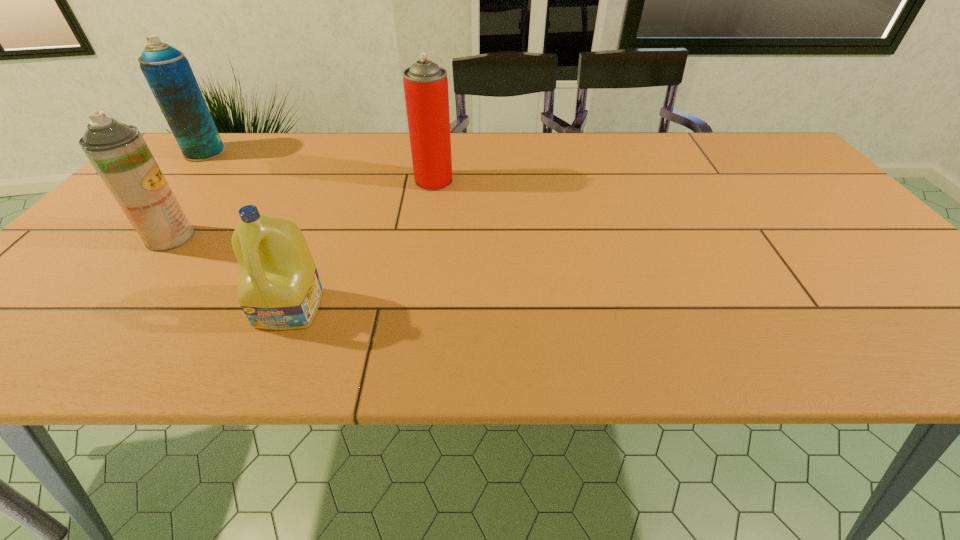
This screenshot has height=540, width=960. In order to click on vacant region between the third farthest object and the shortest object in this screenshot , I will do `click(230, 273)`.

The height and width of the screenshot is (540, 960). Identify the location of vacant space that's between the nearest aerosol can and the third nearest object. (302, 209).

The width and height of the screenshot is (960, 540). I want to click on blank region between the rightmost aerosol can and the shortest object, so click(362, 244).

The image size is (960, 540). I want to click on free space between the nearest aerosol can and the second farthest object, so click(x=302, y=209).

Where is `unoccupied position between the farthest aerosol can and the third nearest object`? unoccupied position between the farthest aerosol can and the third nearest object is located at coordinates (320, 166).

I want to click on object identified as the second closest to the second nearest object, so click(167, 71).

Locate an element on the screen. The width and height of the screenshot is (960, 540). object that is the third nearest to the farthest aerosol can is located at coordinates (279, 288).

Point out which aerosol can is positioned as the nearest to the rightmost object. Please provide its 2D coordinates. Your answer should be formatted as a tuple, i.e. [(x, y)], where the tuple contains the x and y coordinates of a point satisfying the conditions above.

[(118, 152)]

The height and width of the screenshot is (540, 960). Identify the location of aerosol can identified as the closest to the rightmost aerosol can. (118, 152).